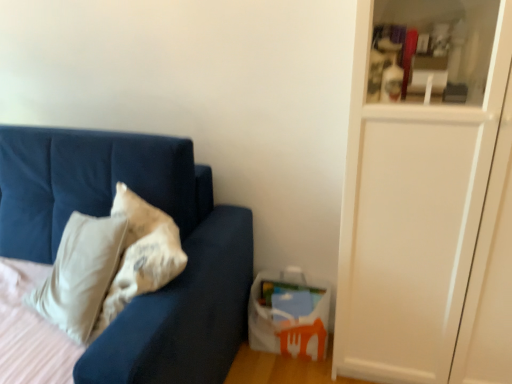
Question: Considering the positions of point (368, 66) and point (136, 180), is point (368, 66) closer or farther from the camera than point (136, 180)?

Choices:
 (A) closer
 (B) farther

Answer: (A)

Question: From a real-world perspective, is transparent glass cabinet at right positioned above or below velvet blue couch at left?

Choices:
 (A) above
 (B) below

Answer: (A)

Question: From the image's perspective, relative to velvet blue couch at left, is transparent glass cabinet at right above or below?

Choices:
 (A) below
 (B) above

Answer: (B)

Question: Considering the positions of velvet blue couch at left and transparent glass cabinet at right in the image, is velvet blue couch at left wider or thinner than transparent glass cabinet at right?

Choices:
 (A) wide
 (B) thin

Answer: (A)

Question: Considering their positions, is velvet blue couch at left located in front of or behind transparent glass cabinet at right?

Choices:
 (A) behind
 (B) front

Answer: (B)

Question: Is velvet blue couch at left inside the boundaries of transparent glass cabinet at right, or outside?

Choices:
 (A) inside
 (B) outside

Answer: (B)

Question: From the image's perspective, is velvet blue couch at left above or below transparent glass cabinet at right?

Choices:
 (A) above
 (B) below

Answer: (B)